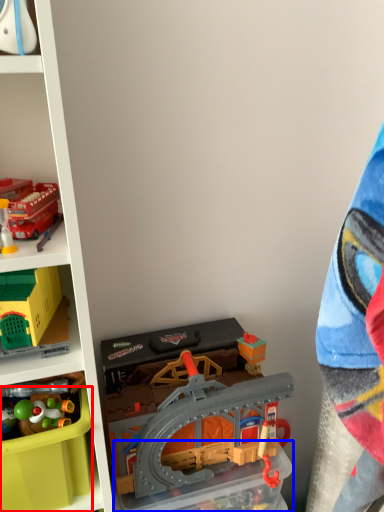
Question: Which of the following is the farthest to the observer, storage box (highlighted by a red box) or storage box (highlighted by a blue box)?

Choices:
 (A) storage box
 (B) storage box

Answer: (B)